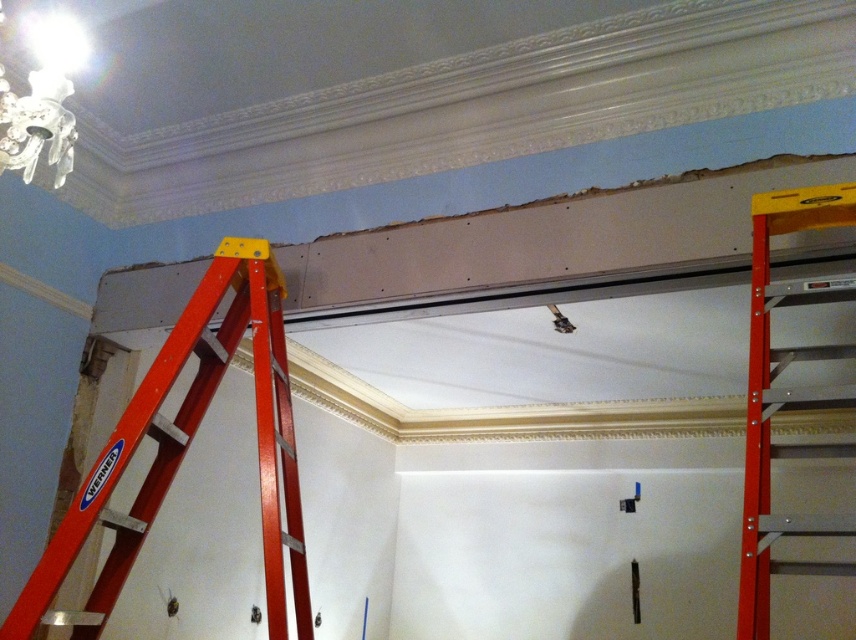
Question: Is matte white chandelier at upper left thinner than metallic silver tool at center?

Choices:
 (A) no
 (B) yes

Answer: (A)

Question: Among these points, which one is farthest from the camera?

Choices:
 (A) (9, 122)
 (B) (28, 637)

Answer: (B)

Question: Does metallic orange ladder at left come behind matte white chandelier at upper left?

Choices:
 (A) no
 (B) yes

Answer: (B)

Question: Which of the following is the farthest from the observer?

Choices:
 (A) metallic orange ladder at center
 (B) metallic orange ladder at left

Answer: (B)

Question: Which is nearer to the metallic silver tool at center?

Choices:
 (A) metallic orange ladder at left
 (B) matte white chandelier at upper left
 (C) metallic orange ladder at center

Answer: (C)

Question: Does metallic orange ladder at left appear on the right side of metallic silver tool at center?

Choices:
 (A) yes
 (B) no

Answer: (B)